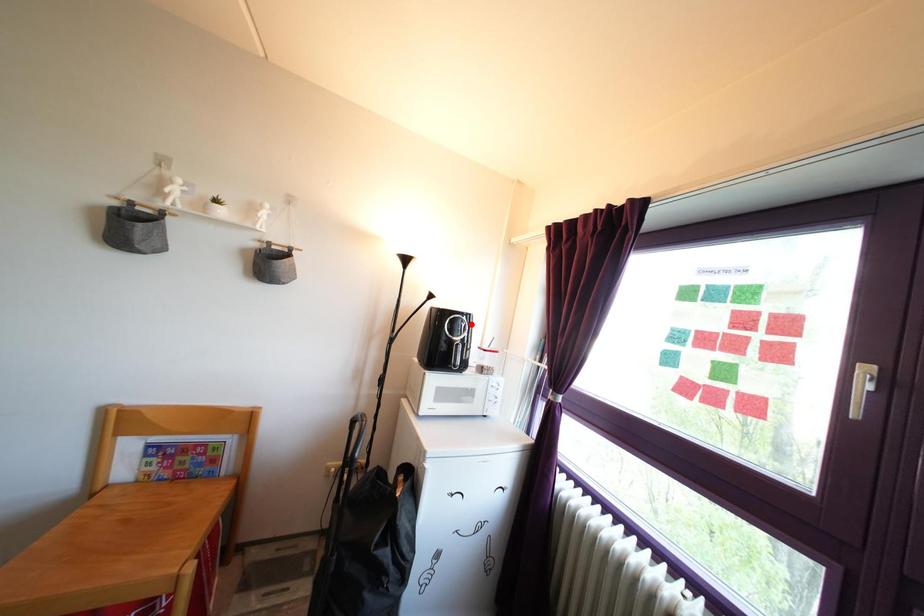
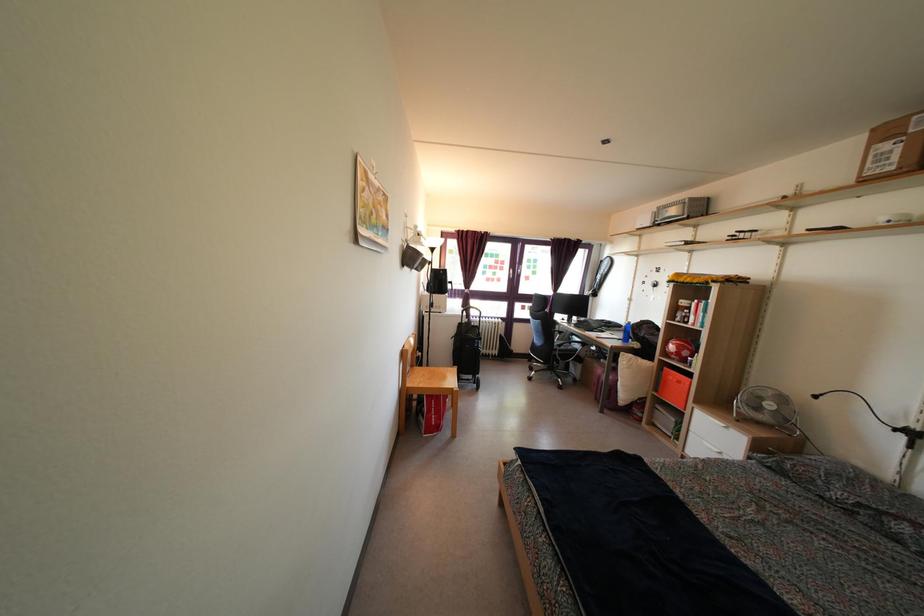
Question: I am providing you with two images of the same scene from different viewpoints. A red point is marked on the first image. At the location where the point appears in image 1, is it still visible in image 2?

Choices:
 (A) Yes
 (B) No

Answer: (B)